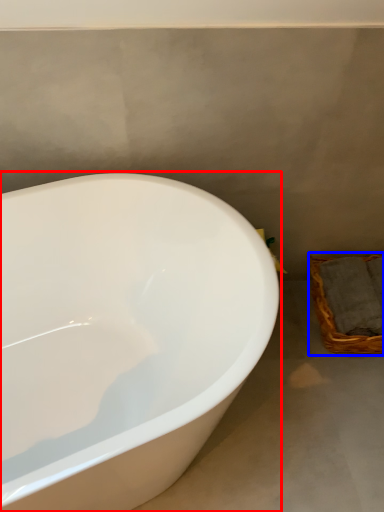
Question: Which object appears farthest to the camera in this image, bathtub (highlighted by a red box) or basket (highlighted by a blue box)?

Choices:
 (A) bathtub
 (B) basket

Answer: (B)